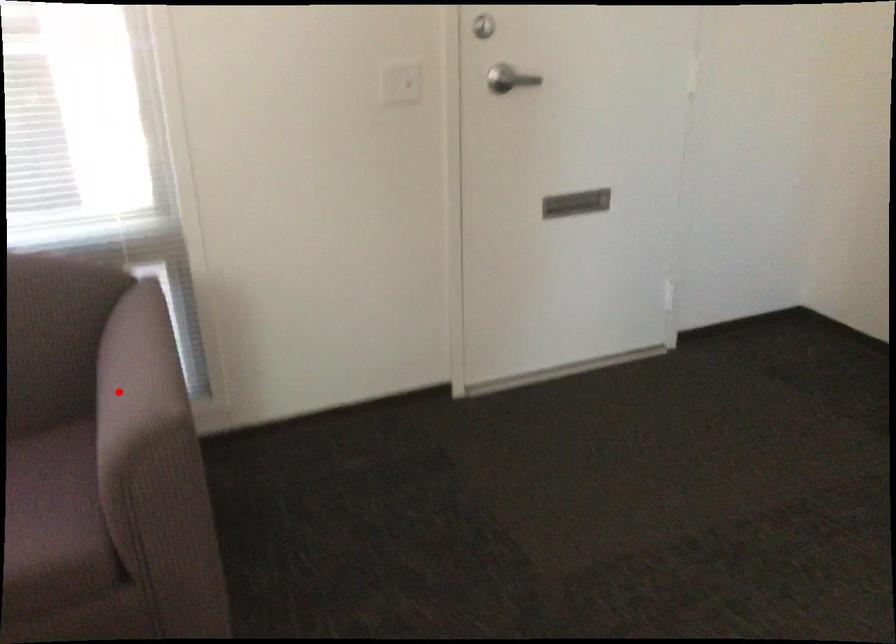
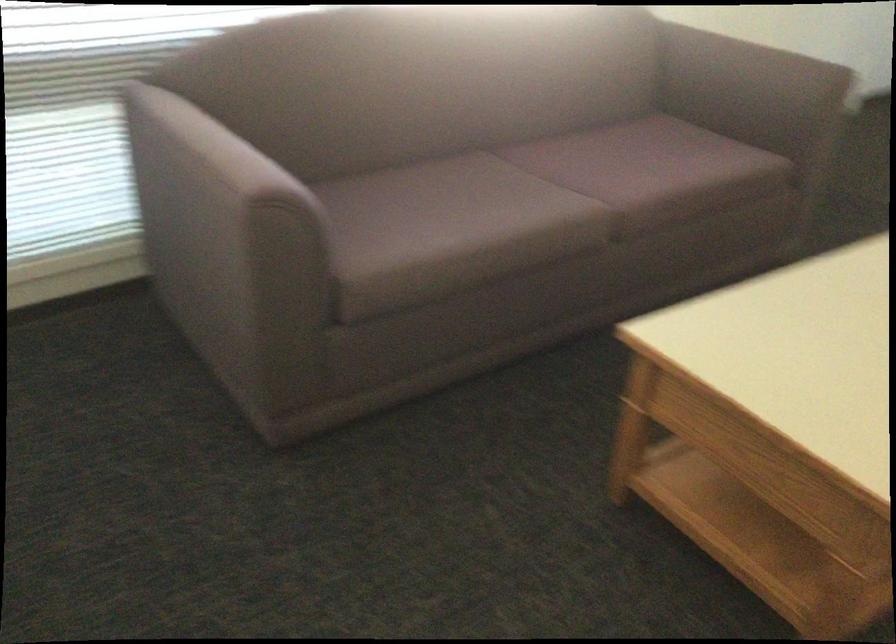
Question: I am providing you with two images of the same scene from different viewpoints. A red point is shown in image1. For the corresponding object point in image2, is it positioned nearer or farther from the camera?

Choices:
 (A) Nearer
 (B) Farther

Answer: (B)